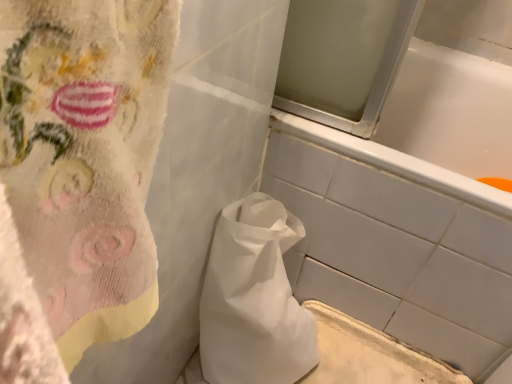
Where is `white matte bathtub at center`? white matte bathtub at center is located at coordinates (409, 210).

This screenshot has height=384, width=512. Describe the element at coordinates (409, 210) in the screenshot. I see `white matte bathtub at center` at that location.

The height and width of the screenshot is (384, 512). What are the coordinates of `white paper bag at center` in the screenshot? It's located at (x=254, y=299).

What do you see at coordinates (254, 299) in the screenshot? The height and width of the screenshot is (384, 512). I see `white paper bag at center` at bounding box center [254, 299].

Identify the location of white matte bathtub at center. (409, 210).

Which object is positioned more to the left, white paper bag at center or white matte bathtub at center?

From the viewer's perspective, white paper bag at center appears more on the left side.

Which object is further away from the camera taking this photo, white paper bag at center or white matte bathtub at center?

white matte bathtub at center is behind.

Which point is more distant from viewer, (287, 321) or (436, 242)?

The point (287, 321) is behind.

From the image's perspective, which is above, white paper bag at center or white matte bathtub at center?

From the image's view, white matte bathtub at center is above.

From a real-world perspective, between white paper bag at center and white matte bathtub at center, who is vertically lower?

white paper bag at center.

From the picture: Is white paper bag at center thinner than white matte bathtub at center?

Yes, white paper bag at center is thinner than white matte bathtub at center.

Is white paper bag at center taller than white matte bathtub at center?

No, white paper bag at center is not taller than white matte bathtub at center.

Considering the sizes of objects white paper bag at center and white matte bathtub at center in the image provided, who is bigger, white paper bag at center or white matte bathtub at center?

Bigger between the two is white matte bathtub at center.

Is white matte bathtub at center completely or partially inside white paper bag at center?

No.

Is white paper bag at center with white matte bathtub at center?

white paper bag at center and white matte bathtub at center are not in contact.

Does white paper bag at center turn towards white matte bathtub at center?

No, white paper bag at center is not aimed at white matte bathtub at center.

How different are the orientations of white paper bag at center and white matte bathtub at center in degrees?

The angle between the facing direction of white paper bag at center and the facing direction of white matte bathtub at center is 90.5 degrees.

Where is `paper bag lying in front of the white matte bathtub at center`? paper bag lying in front of the white matte bathtub at center is located at coordinates (254, 299).

Does white matte bathtub at center appear on the left side of white paper bag at center?

No, white matte bathtub at center is not to the left of white paper bag at center.

Is the position of white matte bathtub at center less distant than that of white paper bag at center?

That is False.

Between point (360, 261) and point (230, 355), which one is positioned in front?

The point (230, 355) is closer.

From the image's perspective, which one is positioned lower, white matte bathtub at center or white paper bag at center?

white paper bag at center, from the image's perspective.

From a real-world perspective, is white matte bathtub at center physically located above or below white paper bag at center?

In terms of real-world spatial position, white matte bathtub at center is above white paper bag at center.

Which of these two, white matte bathtub at center or white paper bag at center, is thinner?

Thinner between the two is white paper bag at center.

Considering the relative sizes of white matte bathtub at center and white paper bag at center in the image provided, is white matte bathtub at center taller than white paper bag at center?

Yes.

Between white matte bathtub at center and white paper bag at center, which one has larger size?

Bigger between the two is white matte bathtub at center.

Choose the correct answer: Is white matte bathtub at center inside white paper bag at center or outside it?

white matte bathtub at center is spatially situated outside white paper bag at center.

Is white matte bathtub at center directly adjacent to white paper bag at center?

No, white matte bathtub at center is not touching white paper bag at center.

Is white matte bathtub at center oriented away from white paper bag at center?

No, white matte bathtub at center is not facing the opposite direction of white paper bag at center.

Can you tell me how much white matte bathtub at center and white paper bag at center differ in facing direction?

The angular difference between white matte bathtub at center and white paper bag at center is 90.5 degrees.

In order to click on paper bag located underneath the white matte bathtub at center (from a real-world perspective) in this screenshot , I will do `click(254, 299)`.

Find the location of a particular element. bath that appears above the white paper bag at center (from the image's perspective) is located at coordinates (409, 210).

This screenshot has height=384, width=512. I want to click on bath behind the white paper bag at center, so click(x=409, y=210).